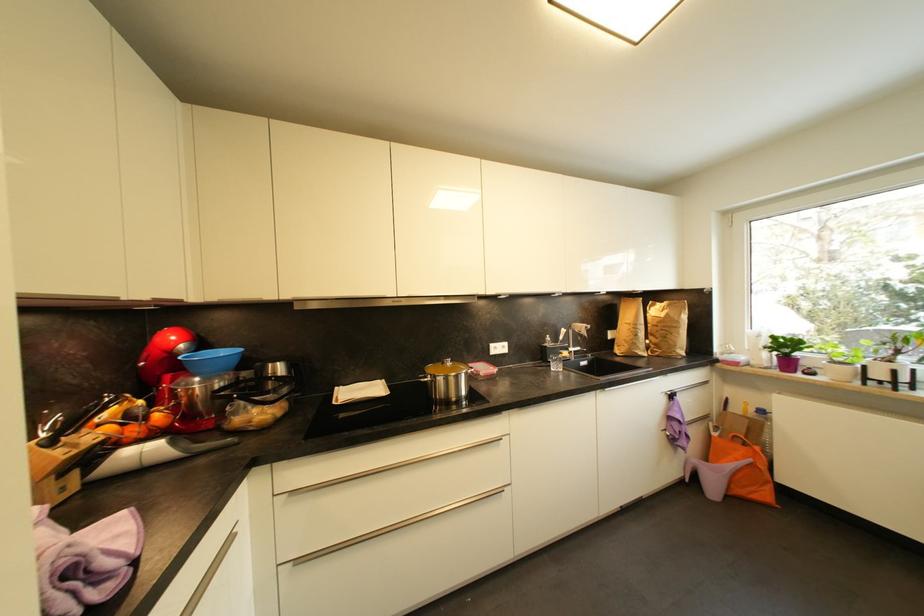
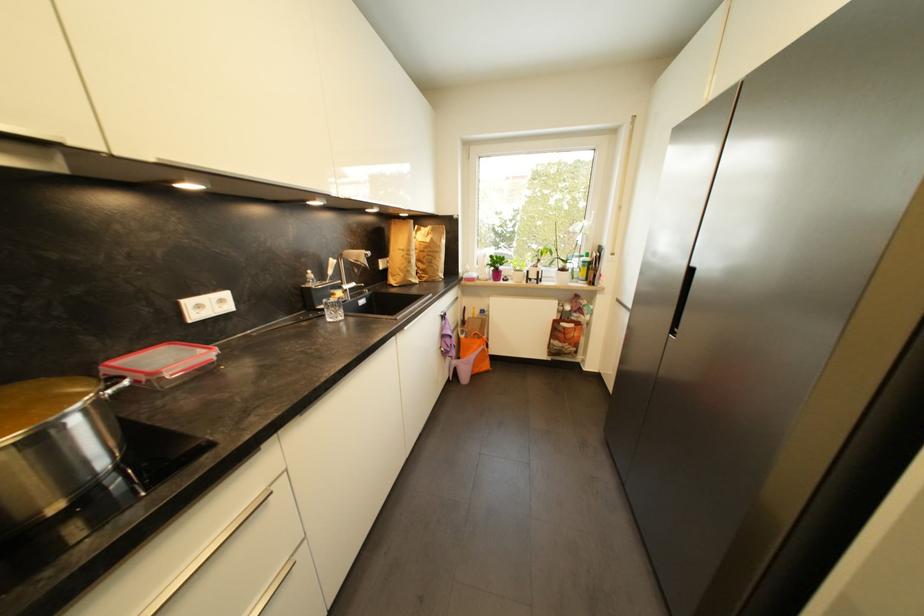
Question: Based on the continuous images, in which direction is the camera rotating? Reply with the corresponding letter.

Choices:
 (A) Left
 (B) Right
 (C) Up
 (D) Down

Answer: (B)